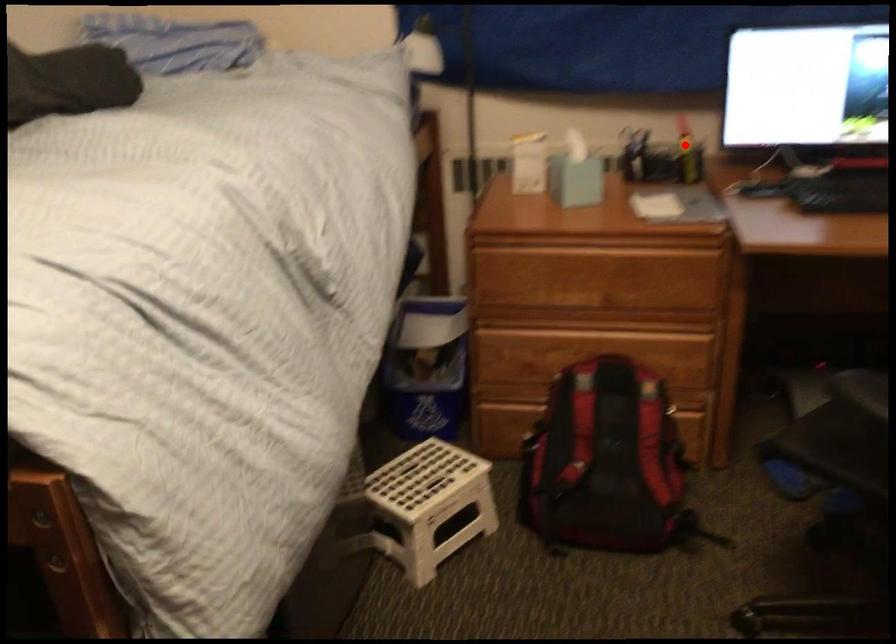
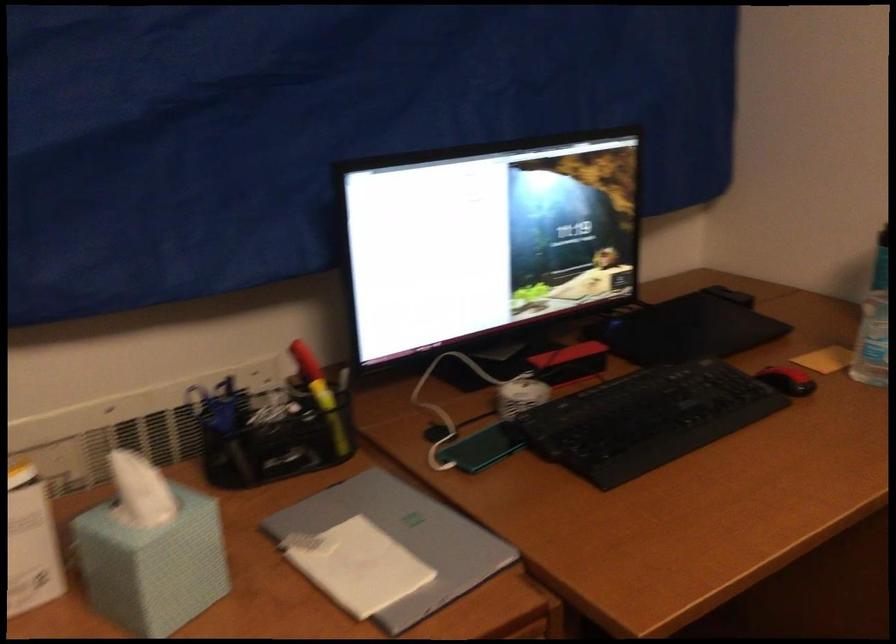
Find the pixel in the second image that matches the highlighted location in the first image.

(321, 395)